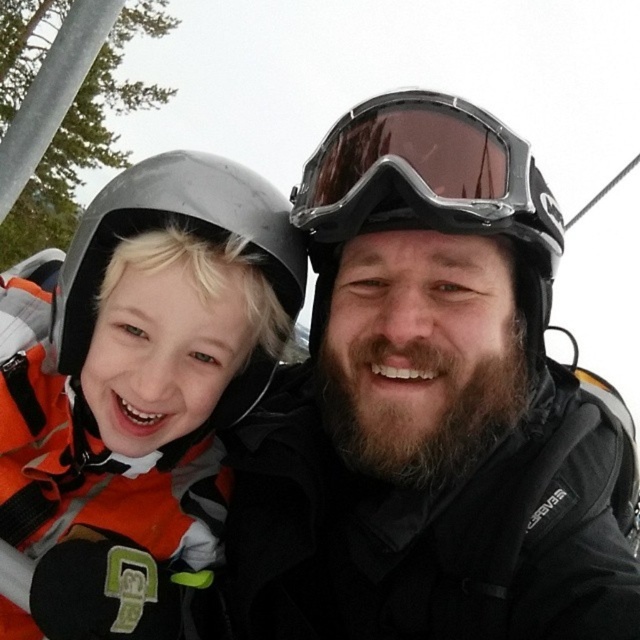
You are a photographer trying to capture a candid shot of the two individuals on the ski lift. You want to ensure the black matte helmet at upper center and the matte black helmet at left are both visible in the frame. Based on their positions, which helmet is positioned to the right side of the other?

The black matte helmet at upper center is to the right of the matte black helmet at left.

You are a photographer trying to capture a candid shot of the two people on the ski lift. You need to ensure both the black matte helmet at upper center and the transparent plastic goggles at center are visible in the frame. Based on their positions, which object should you focus on first to include both in the shot?

The black matte helmet at upper center is to the right of the transparent plastic goggles at center. To include both in the shot, focus on the transparent plastic goggles at center first since it is on the left, allowing the photographer to frame the shot from left to right to capture both objects.

You are designing a storage compartment for ski gear. The compartment has two slots, one for helmets and one for goggles. Given the sizes of the black matte helmet at upper center and transparent plastic goggles at center, which slot should each item go into?

The black matte helmet at upper center has a larger size compared to transparent plastic goggles at center, so the larger slot should be for the black matte helmet at upper center and the smaller slot for the transparent plastic goggles at center.